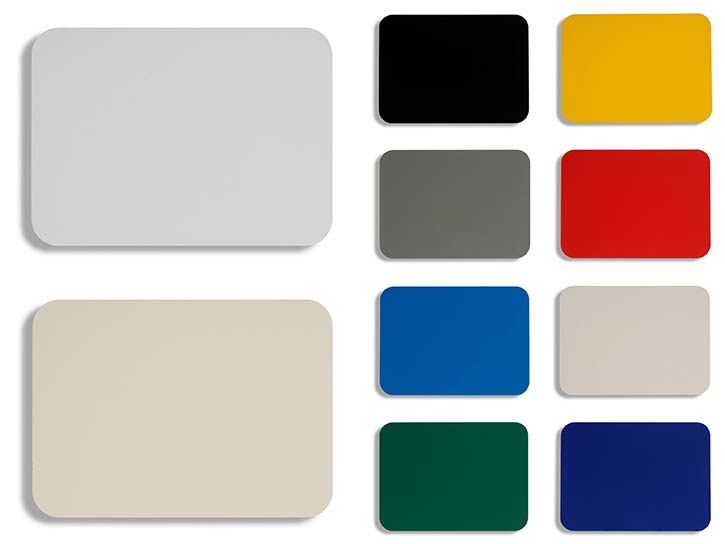
The image size is (725, 544). I want to click on tile directly to left of yellow tile, so click(476, 72).